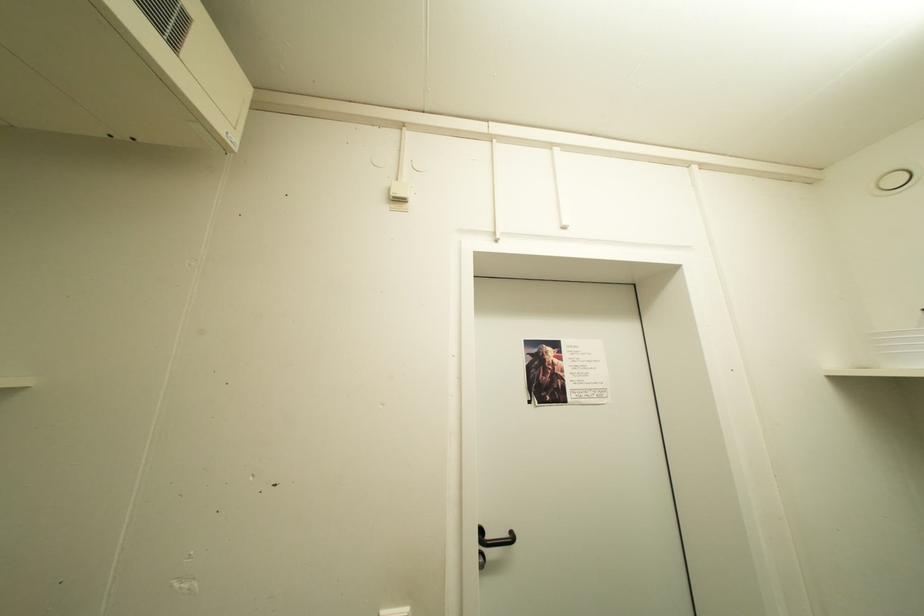
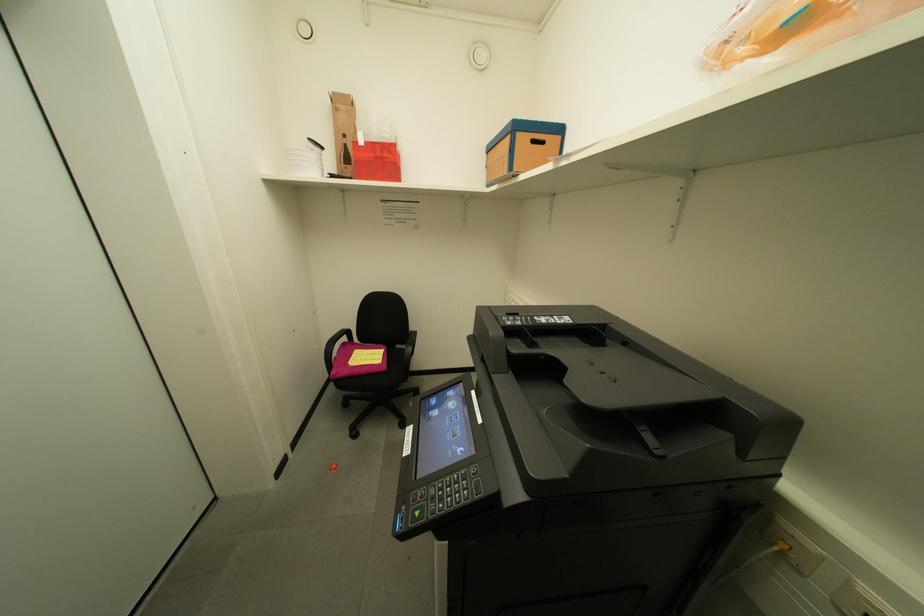
The first image is from the beginning of the video and the second image is from the end. How did the camera likely rotate when shooting the video?

The camera rotated toward right-down.